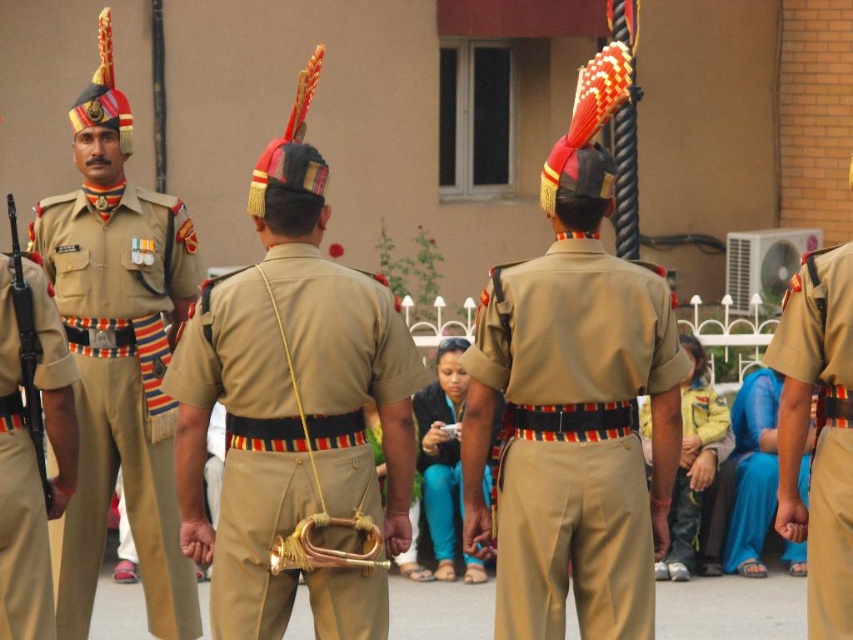
Does khaki cotton pants at right appear on the left side of gold brass trumpet at center?

No, khaki cotton pants at right is not to the left of gold brass trumpet at center.

Who is lower down, khaki cotton pants at right or gold brass trumpet at center?

gold brass trumpet at center is lower down.

Who is more distant from viewer, (817, 564) or (283, 554)?

The point (817, 564) is more distant.

This screenshot has height=640, width=853. What are the coordinates of `khaki cotton pants at right` in the screenshot? It's located at (817, 432).

Does point (778, 449) come behind point (73, 465)?

Yes.

Is point (807, 561) positioned in front of point (24, 486)?

No, it is behind (24, 486).

You are a GUI agent. You are given a task and a screenshot of the screen. Output one action in this format:
    pyautogui.click(x=<x>, y=<y>)
    Task: Click on the khaki cotton pants at right
    
    Given the screenshot: What is the action you would take?
    pyautogui.click(x=817, y=432)

Is matte gold trumpet at center further to the viewer compared to khaki cotton pants at lower right?

No, it is in front of khaki cotton pants at lower right.

Who is more distant from viewer, (305, 252) or (686, 417)?

The point (686, 417) is behind.

At what (x,y) coordinates should I click in order to perform the action: click on matte gold trumpet at center. Please return your answer as a coordinate pair (x, y). Looking at the image, I should click on (283, 416).